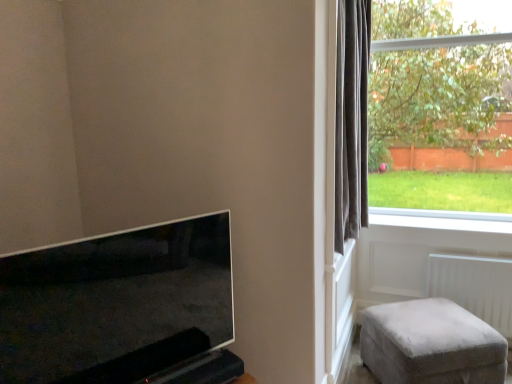
Question: Does white plastic radiator at lower right have a lesser height compared to dark grey velvet curtain at right?

Choices:
 (A) no
 (B) yes

Answer: (B)

Question: Are white plastic radiator at lower right and dark grey velvet curtain at right far apart?

Choices:
 (A) yes
 (B) no

Answer: (B)

Question: Is the depth of white plastic radiator at lower right greater than that of dark grey velvet curtain at right?

Choices:
 (A) yes
 (B) no

Answer: (A)

Question: Is white plastic radiator at lower right at the left side of dark grey velvet curtain at right?

Choices:
 (A) no
 (B) yes

Answer: (A)

Question: Can you see white plastic radiator at lower right touching dark grey velvet curtain at right?

Choices:
 (A) yes
 (B) no

Answer: (B)

Question: Is white plastic radiator at lower right thinner than dark grey velvet curtain at right?

Choices:
 (A) yes
 (B) no

Answer: (A)

Question: Is dark grey velvet curtain at right surrounded by white smooth window sill at lower right?

Choices:
 (A) no
 (B) yes

Answer: (A)

Question: Is white smooth window sill at lower right bigger than dark grey velvet curtain at right?

Choices:
 (A) no
 (B) yes

Answer: (A)

Question: Is white smooth window sill at lower right at the right side of dark grey velvet curtain at right?

Choices:
 (A) no
 (B) yes

Answer: (B)

Question: From the image's perspective, is white smooth window sill at lower right under dark grey velvet curtain at right?

Choices:
 (A) yes
 (B) no

Answer: (A)

Question: Does white smooth window sill at lower right have a lesser height compared to dark grey velvet curtain at right?

Choices:
 (A) yes
 (B) no

Answer: (A)

Question: Does white smooth window sill at lower right have a greater height compared to dark grey velvet curtain at right?

Choices:
 (A) no
 (B) yes

Answer: (A)

Question: From the image's perspective, is matte black tv at lower left located beneath white smooth window sill at lower right?

Choices:
 (A) yes
 (B) no

Answer: (A)